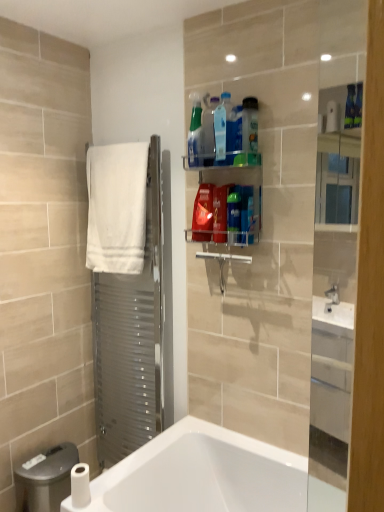
Describe the element at coordinates (80, 485) in the screenshot. The width and height of the screenshot is (384, 512). I see `white matte toilet paper at lower left` at that location.

Find the location of a particular element. white glossy bathtub at lower left is located at coordinates (211, 475).

Measure the distance between point (233, 196) and camera.

Point (233, 196) is 1.61 meters away from camera.

What is the approximate height of translucent plastic bottle at upper center, arranged as the third cleaning product when viewed from the right?

8.86 inches.

Describe the element at coordinates (333, 298) in the screenshot. This screenshot has height=512, width=384. I see `transparent glass screen door at right, acting as the first screen door starting from the front` at that location.

Describe the element at coordinates (220, 213) in the screenshot. The height and width of the screenshot is (512, 384). I see `translucent plastic bottle at upper center, acting as the 5th cleaning product starting from the left` at that location.

The width and height of the screenshot is (384, 512). What do you see at coordinates (46, 479) in the screenshot? I see `metallic trash can at lower left` at bounding box center [46, 479].

Identify the location of white matte toilet paper at lower left. (80, 485).

Is blue plastic bottle at upper center to the left of white soft towel at left from the viewer's perspective?

No, blue plastic bottle at upper center is not to the left of white soft towel at left.

Which of these two, blue plastic bottle at upper center or white soft towel at left, is smaller?

blue plastic bottle at upper center is smaller.

Considering the points (239, 140) and (131, 152), which point is in front, point (239, 140) or point (131, 152)?

Positioned in front is point (239, 140).

Considering the positions of objects blue plastic bottle at upper center and white soft towel at left in the image provided, who is in front, blue plastic bottle at upper center or white soft towel at left?

blue plastic bottle at upper center.

Which of these two, translucent plastic spray bottle at upper center, which appears as the 4th cleaning product when viewed from the left, or white matte toilet paper at lower left, is wider?

Wider between the two is white matte toilet paper at lower left.

Between translucent plastic spray bottle at upper center, which is the 5th cleaning product from right to left, and white matte toilet paper at lower left, which one has larger size?

Bigger between the two is translucent plastic spray bottle at upper center, which is the 5th cleaning product from right to left.

Does translucent plastic spray bottle at upper center, which is the 5th cleaning product from right to left, contain white matte toilet paper at lower left?

Actually, white matte toilet paper at lower left is outside translucent plastic spray bottle at upper center, which is the 5th cleaning product from right to left.

Does translucent plastic spray bottle at upper center, which is the 5th cleaning product from right to left, have a greater height compared to white matte toilet paper at lower left?

Indeed, translucent plastic spray bottle at upper center, which is the 5th cleaning product from right to left, has a greater height compared to white matte toilet paper at lower left.

How far apart are transparent glass screen door at right, acting as the first screen door starting from the front, and white soft towel at left?

transparent glass screen door at right, acting as the first screen door starting from the front, is 35.45 inches from white soft towel at left.

Is the position of transparent glass screen door at right, acting as the first screen door starting from the front, more distant than that of white soft towel at left?

No, transparent glass screen door at right, acting as the first screen door starting from the front, is closer to the viewer.

In the scene shown: Are transparent glass screen door at right, which is the 1th screen door from right to left, and white soft towel at left far apart?

transparent glass screen door at right, which is the 1th screen door from right to left, is actually quite close to white soft towel at left.

Is white soft towel at left completely or partially inside transparent glass screen door at right, the second screen door in the back-to-front sequence?

Definitely not — white soft towel at left is not inside transparent glass screen door at right, the second screen door in the back-to-front sequence.

Is translucent plastic spray bottle at upper center, the seventh cleaning product viewed from the left, at the left side of blue plastic bottle at upper center?

Incorrect, translucent plastic spray bottle at upper center, the seventh cleaning product viewed from the left, is not on the left side of blue plastic bottle at upper center.

From the image's perspective, between translucent plastic spray bottle at upper center, the seventh cleaning product viewed from the left, and blue plastic bottle at upper center, who is located below?

translucent plastic spray bottle at upper center, the seventh cleaning product viewed from the left, appears lower in the image.

Is blue plastic bottle at upper center inside translucent plastic spray bottle at upper center, the seventh cleaning product viewed from the left?

No, translucent plastic spray bottle at upper center, the seventh cleaning product viewed from the left, does not contain blue plastic bottle at upper center.

From a real-world perspective, is translucent plastic spray bottle at upper center, marked as the 2th cleaning product in a right-to-left arrangement, below blue plastic bottle at upper center?

Correct, in the physical world, translucent plastic spray bottle at upper center, marked as the 2th cleaning product in a right-to-left arrangement, is lower than blue plastic bottle at upper center.

Which is behind, point (248, 157) or point (257, 218)?

The point (257, 218) is more distant.

Who is bigger, translucent plastic bottle at upper center, the first cleaning product in the right-to-left sequence, or translucent plastic bottles at upper center?

translucent plastic bottles at upper center.

Does translucent plastic bottle at upper center, the first cleaning product in the right-to-left sequence, lie in front of translucent plastic bottles at upper center?

No, translucent plastic bottle at upper center, the first cleaning product in the right-to-left sequence, is behind translucent plastic bottles at upper center.

Between translucent plastic bottle at upper center, the first cleaning product in the right-to-left sequence, and translucent plastic bottles at upper center, which one appears on the left side from the viewer's perspective?

From the viewer's perspective, translucent plastic bottles at upper center appears more on the left side.

Looking at this image, is translucent plastic spray bottle at upper center, marked as the 2th cleaning product in a right-to-left arrangement, at the back of translucent plastic spray bottle at upper center, which appears as the 4th cleaning product when viewed from the left?

That's not correct — translucent plastic spray bottle at upper center, which appears as the 4th cleaning product when viewed from the left, is not looking away from translucent plastic spray bottle at upper center, marked as the 2th cleaning product in a right-to-left arrangement.

Which of these two, translucent plastic spray bottle at upper center, which appears as the 4th cleaning product when viewed from the left, or translucent plastic spray bottle at upper center, marked as the 2th cleaning product in a right-to-left arrangement, stands shorter?

Standing shorter between the two is translucent plastic spray bottle at upper center, marked as the 2th cleaning product in a right-to-left arrangement.

Which is behind, point (224, 106) or point (246, 210)?

Point (246, 210)

How different are the orientations of translucent plastic spray bottle at upper center, which appears as the 4th cleaning product when viewed from the left, and translucent plastic spray bottle at upper center, marked as the 2th cleaning product in a right-to-left arrangement, in degrees?

They differ by 0.00721 degrees in their facing directions.

Would you say translucent plastic spray bottle at upper center, which is the 8th cleaning product from right to left, is inside or outside translucent plastic spray bottle at upper center, which appears as the 4th cleaning product when viewed from the left?

translucent plastic spray bottle at upper center, which is the 8th cleaning product from right to left, is located beyond the bounds of translucent plastic spray bottle at upper center, which appears as the 4th cleaning product when viewed from the left.

Looking at this image, from the image's perspective, is translucent plastic spray bottle at upper center, which is the 8th cleaning product from right to left, beneath translucent plastic spray bottle at upper center, which appears as the 4th cleaning product when viewed from the left?

No, from the image's perspective, translucent plastic spray bottle at upper center, which is the 8th cleaning product from right to left, is not beneath translucent plastic spray bottle at upper center, which appears as the 4th cleaning product when viewed from the left.

Which of these two, translucent plastic spray bottle at upper center, which is the 8th cleaning product from right to left, or translucent plastic spray bottle at upper center, which appears as the 4th cleaning product when viewed from the left, stands shorter?

translucent plastic spray bottle at upper center, which appears as the 4th cleaning product when viewed from the left.

Which is in front, translucent plastic spray bottle at upper center, which is the 8th cleaning product from right to left, or translucent plastic spray bottle at upper center, which appears as the 4th cleaning product when viewed from the left?

translucent plastic spray bottle at upper center, which appears as the 4th cleaning product when viewed from the left.

The width and height of the screenshot is (384, 512). In order to click on bath towel below the blue plastic bottle at upper center (from the image's perspective) in this screenshot , I will do `click(116, 207)`.

This screenshot has width=384, height=512. I want to click on toilet paper in front of the translucent plastic spray bottle at upper center, which appears as the 4th cleaning product when viewed from the left, so 80,485.

Estimate the real-world distances between objects in this image. Which object is closer to translucent plastic bottles at upper center, translucent plastic bottle at upper center, the 4th cleaning product positioned from the right, or transparent glass screen door at right, which is counted as the second screen door, starting from the left?

The object closer to translucent plastic bottles at upper center is translucent plastic bottle at upper center, the 4th cleaning product positioned from the right.

Looking at the image, which one is located further to translucent plastic spray bottle at upper center, which is the 5th cleaning product from right to left, white glossy bathtub at lower left or translucent plastic bottle at upper center, the sixth cleaning product when ordered from left to right?

white glossy bathtub at lower left lies further to translucent plastic spray bottle at upper center, which is the 5th cleaning product from right to left, than the other object.

Consider the image. Considering their positions, is translucent plastic bottle at upper center, the eighth cleaning product from the left, positioned closer to transparent glass screen door at right, which is counted as the second screen door, starting from the left, than translucent plastic bottle at upper center, the 4th cleaning product positioned from the right?

Based on the image, translucent plastic bottle at upper center, the eighth cleaning product from the left, appears to be nearer to transparent glass screen door at right, which is counted as the second screen door, starting from the left.

Which object lies further to the anchor point blue plastic bottle at upper center, transparent glass screen door at right, which is the 1th screen door from right to left, or translucent plastic bottle at upper center, the sixth cleaning product when ordered from left to right?

Based on the image, transparent glass screen door at right, which is the 1th screen door from right to left, appears to be further to blue plastic bottle at upper center.

Which object lies further to the anchor point transparent glass screen door at right, which is counted as the second screen door, starting from the left, translucent plastic spray bottle at upper center, the sixth cleaning product in the right-to-left sequence, or translucent plastic spray bottle at upper center, the seventh cleaning product viewed from the left?

Among the two, translucent plastic spray bottle at upper center, the sixth cleaning product in the right-to-left sequence, is located further to transparent glass screen door at right, which is counted as the second screen door, starting from the left.

Which object lies further to the anchor point white soft towel at left, white matte toilet paper at lower left or transparent glass screen door at right, which is counted as the second screen door, starting from the left?

The object further to white soft towel at left is white matte toilet paper at lower left.

Based on their spatial positions, is translucent plastic spray bottle at upper center, positioned as the third cleaning product in left-to-right order, or white matte toilet paper at lower left further from translucent plastic spray bottle at upper center, which appears as the 4th cleaning product when viewed from the left?

Among the two, white matte toilet paper at lower left is located further to translucent plastic spray bottle at upper center, which appears as the 4th cleaning product when viewed from the left.

Looking at the image, which one is located closer to translucent plastic bottle at upper center, acting as the 5th cleaning product starting from the left, white glossy bathtub at lower left or metallic trash can at lower left?

Among the two, white glossy bathtub at lower left is located nearer to translucent plastic bottle at upper center, acting as the 5th cleaning product starting from the left.

This screenshot has height=512, width=384. Find the location of `toilet paper that lies between translucent plastic spray bottle at upper center, which is the 5th cleaning product from right to left, and white glossy bathtub at lower left from top to bottom`. toilet paper that lies between translucent plastic spray bottle at upper center, which is the 5th cleaning product from right to left, and white glossy bathtub at lower left from top to bottom is located at coordinates (80, 485).

I want to click on shelf between translucent plastic spray bottle at upper center, which ranks as the 1th cleaning product in left-to-right order, and metallic trash can at lower left from top to bottom, so pos(226,204).

You are a GUI agent. You are given a task and a screenshot of the screen. Output one action in this format:
    pyautogui.click(x=<x>, y=<y>)
    Task: Click on the toilet paper that lies between white soft towel at left and metallic trash can at lower left from top to bottom
    
    Given the screenshot: What is the action you would take?
    pyautogui.click(x=80, y=485)

Locate an element on the screen. shelf between translucent plastic spray bottle at upper center, which appears as the 4th cleaning product when viewed from the left, and translucent plastic bottle at upper center, the sixth cleaning product when ordered from left to right, in the up-down direction is located at coordinates (226, 204).